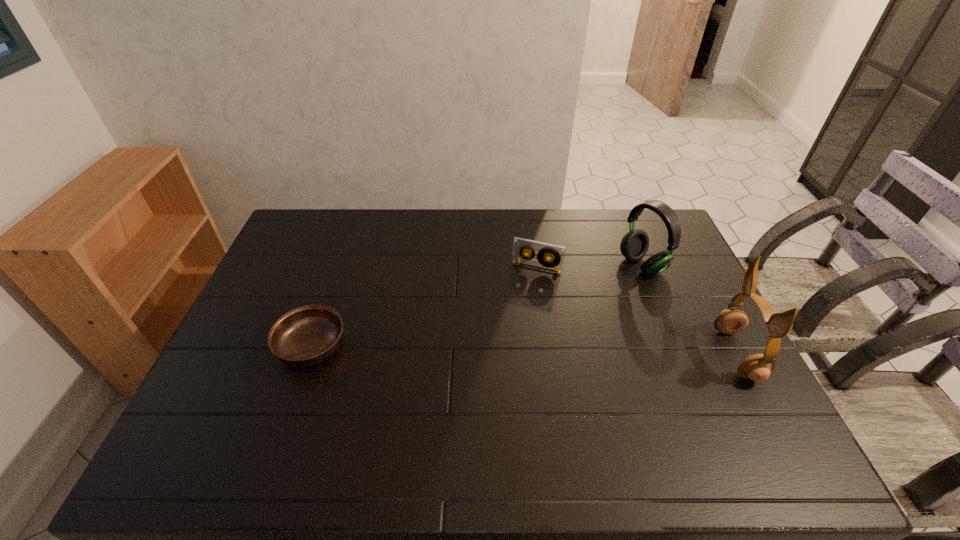
You are a GUI agent. You are given a task and a screenshot of the screen. Output one action in this format:
    pyautogui.click(x=<x>, y=<y>)
    Task: Click on the soup bowl
    The image size is (960, 540).
    Given the screenshot: What is the action you would take?
    pyautogui.click(x=308, y=335)

At what (x,y) coordinates should I click in order to perform the action: click on the leftmost object. Please return your answer as a coordinate pair (x, y). The width and height of the screenshot is (960, 540). Looking at the image, I should click on (308, 335).

At what (x,y) coordinates should I click in order to perform the action: click on earphone. Please return your answer as a coordinate pair (x, y). The image size is (960, 540). Looking at the image, I should click on (757, 367).

This screenshot has height=540, width=960. Identify the location of videotape. (556, 253).

Identify the location of the third object from right to left. (556, 253).

Image resolution: width=960 pixels, height=540 pixels. I want to click on the third object from left to right, so click(634, 245).

Locate an element on the screen. This screenshot has width=960, height=540. the second tallest object is located at coordinates (634, 245).

At what (x,y) coordinates should I click in order to perform the action: click on vacant area situated on the back of the leftmost object. Please return your answer as a coordinate pair (x, y). Looking at the image, I should click on (334, 282).

This screenshot has width=960, height=540. Find the location of `vacant space located 0.260m on the front-facing side of the earphone`. vacant space located 0.260m on the front-facing side of the earphone is located at coordinates (625, 354).

The image size is (960, 540). Identify the location of free space located on the front-facing side of the earphone. (680, 354).